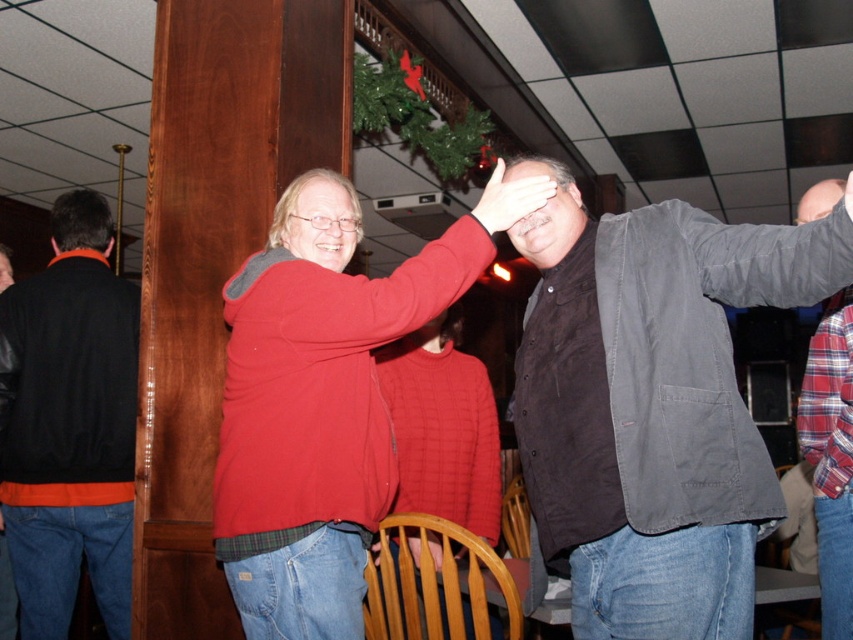
Question: Which point is closer to the camera?

Choices:
 (A) dark gray cotton jacket at center
 (B) plaid flannel shirt at right
 (C) matte red sweater at center
 (D) matte black sweater at center

Answer: (A)

Question: Which point is closer to the camera taking this photo?

Choices:
 (A) (15, 477)
 (B) (15, 593)
 (C) (479, 252)
 (D) (495, 198)

Answer: (D)

Question: Which of the following is the closest to the observer?

Choices:
 (A) (108, 435)
 (B) (9, 611)
 (C) (498, 188)
 (D) (811, 218)

Answer: (C)

Question: Is plaid flannel shirt at right to the right of matte black sweater at center from the viewer's perspective?

Choices:
 (A) no
 (B) yes

Answer: (B)

Question: Is black leather jacket at left in front of matte black sweater at center?

Choices:
 (A) no
 (B) yes

Answer: (B)

Question: Does matte red sweater at center come behind matte black sweater at center?

Choices:
 (A) yes
 (B) no

Answer: (B)